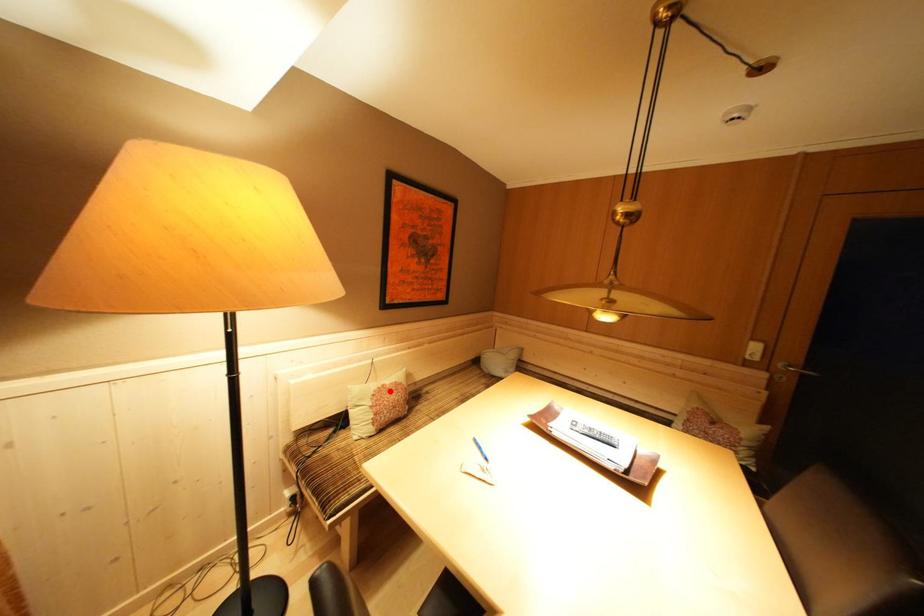
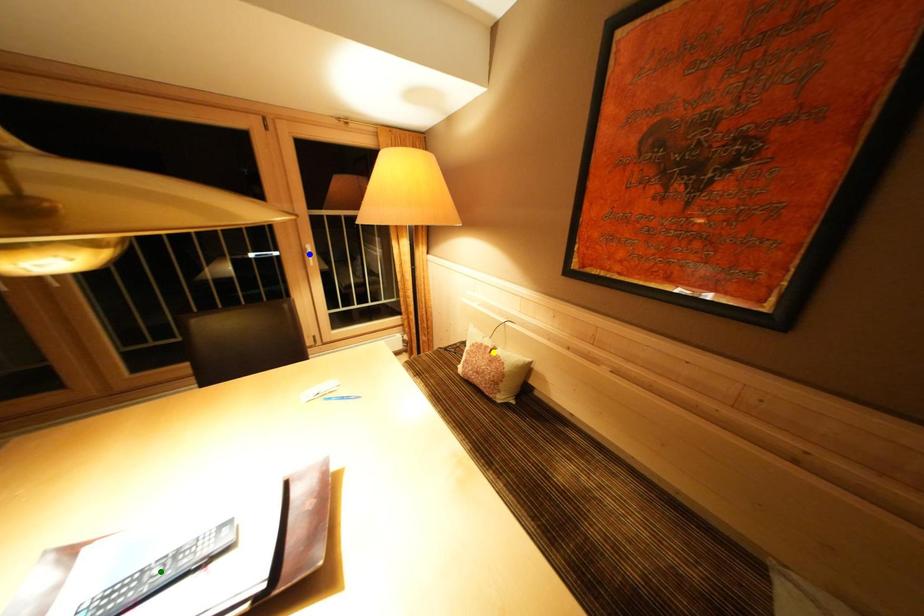
Question: I am providing you with two images of the same scene from different viewpoints. A red point is marked on the first image. You are given multiple points on the second image. In image 2, which mark is for the same physical point as the one in image 1?

Choices:
 (A) blue point
 (B) yellow point
 (C) green point

Answer: (B)